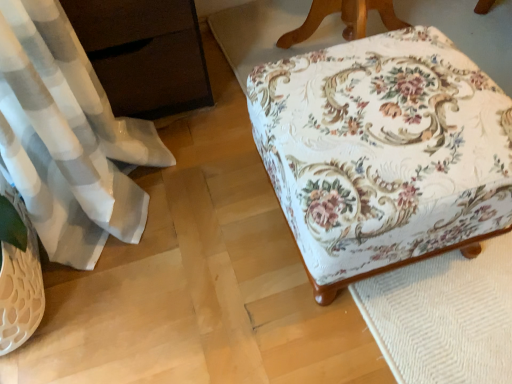
The image size is (512, 384). What do you see at coordinates (383, 152) in the screenshot?
I see `floral fabric ottoman at center` at bounding box center [383, 152].

Find the location of a particular element. floral fabric ottoman at center is located at coordinates (383, 152).

The image size is (512, 384). Identify the location of floral fabric ottoman at center. (383, 152).